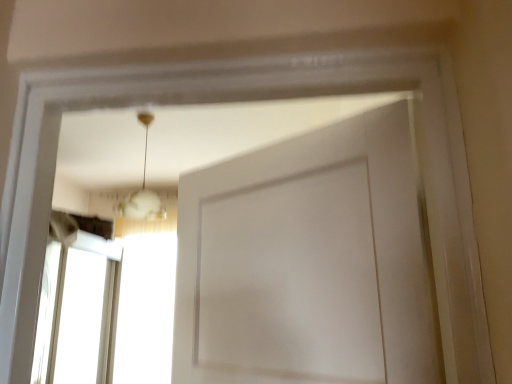
This screenshot has height=384, width=512. What do you see at coordinates (142, 189) in the screenshot? I see `white matte light fixture at upper center` at bounding box center [142, 189].

In order to face white matte light fixture at upper center, should I rotate leftwards or rightwards?

You should rotate left by 15.121 degrees.

Measure the distance between white matte light fixture at upper center and camera.

white matte light fixture at upper center and camera are 4.11 meters apart from each other.

The width and height of the screenshot is (512, 384). I want to click on white matte light fixture at upper center, so click(142, 189).

You are a GUI agent. You are given a task and a screenshot of the screen. Output one action in this format:
    pyautogui.click(x=<x>, y=<y>)
    Task: Click on the white matte light fixture at upper center
    The height and width of the screenshot is (384, 512).
    Given the screenshot: What is the action you would take?
    pyautogui.click(x=142, y=189)